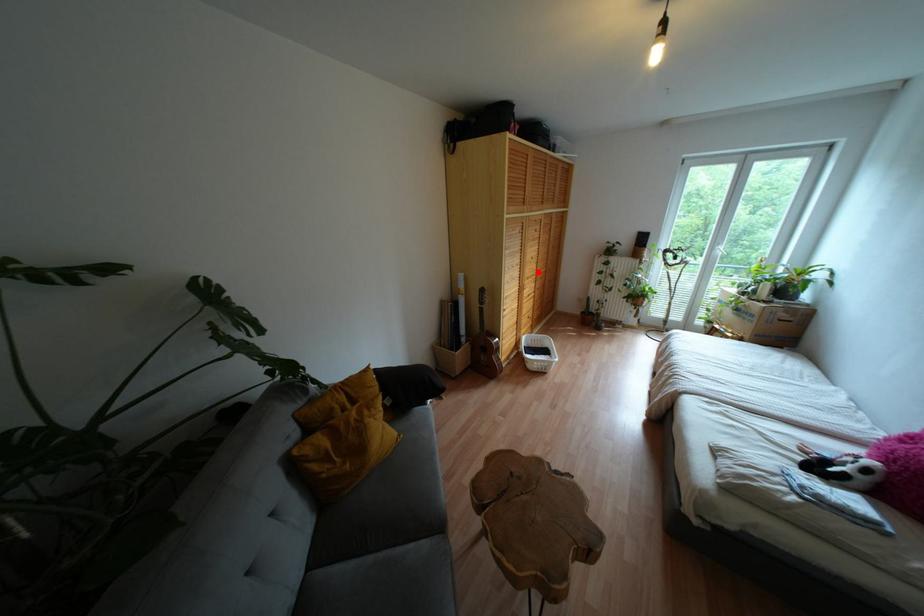
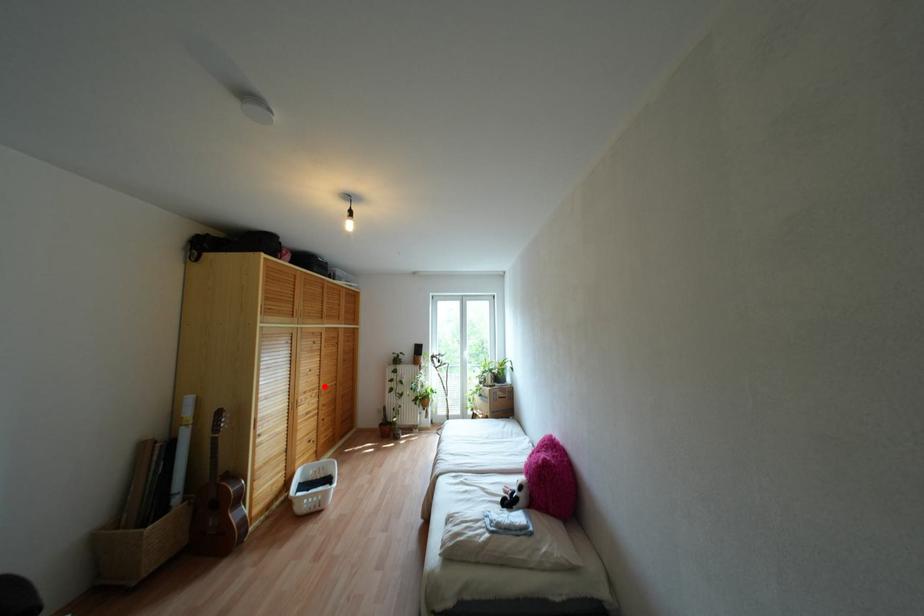
I am providing you with two images of the same scene from different viewpoints. A red point is marked on the first image and another point is marked on the second image. Is the marked point in image1 the same physical position as the marked point in image2?

Yes